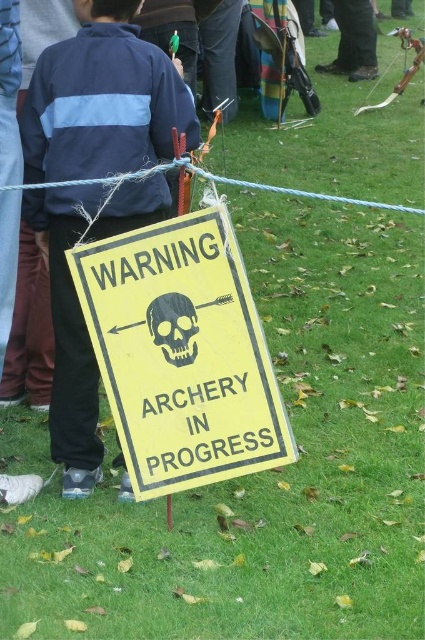
Question: Which point is closer to the camera?

Choices:
 (A) black paper skull at center
 (B) blue fabric jacket at center
 (C) yellow paper sign at center

Answer: (C)

Question: Which point appears farthest from the camera in this image?

Choices:
 (A) (286, 461)
 (B) (47, 115)

Answer: (B)

Question: Considering the relative positions of blue fabric jacket at center and black paper skull at center in the image provided, where is blue fabric jacket at center located with respect to black paper skull at center?

Choices:
 (A) above
 (B) below

Answer: (A)

Question: Is blue fabric jacket at center positioned behind black paper skull at center?

Choices:
 (A) yes
 (B) no

Answer: (A)

Question: Is yellow paper sign at center to the right of black paper skull at center from the viewer's perspective?

Choices:
 (A) yes
 (B) no

Answer: (A)

Question: Which of the following is the closest to the observer?

Choices:
 (A) black paper skull at center
 (B) yellow paper sign at center

Answer: (B)